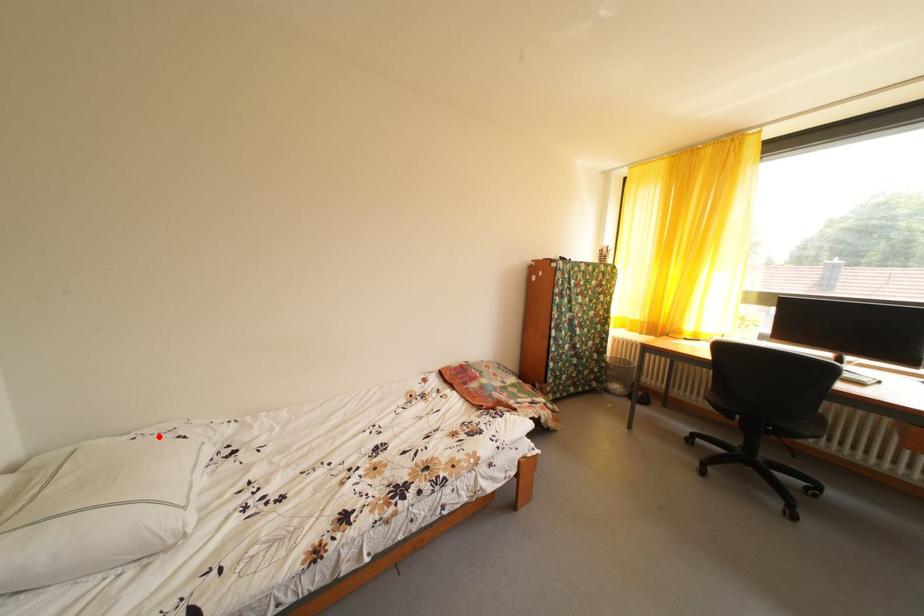
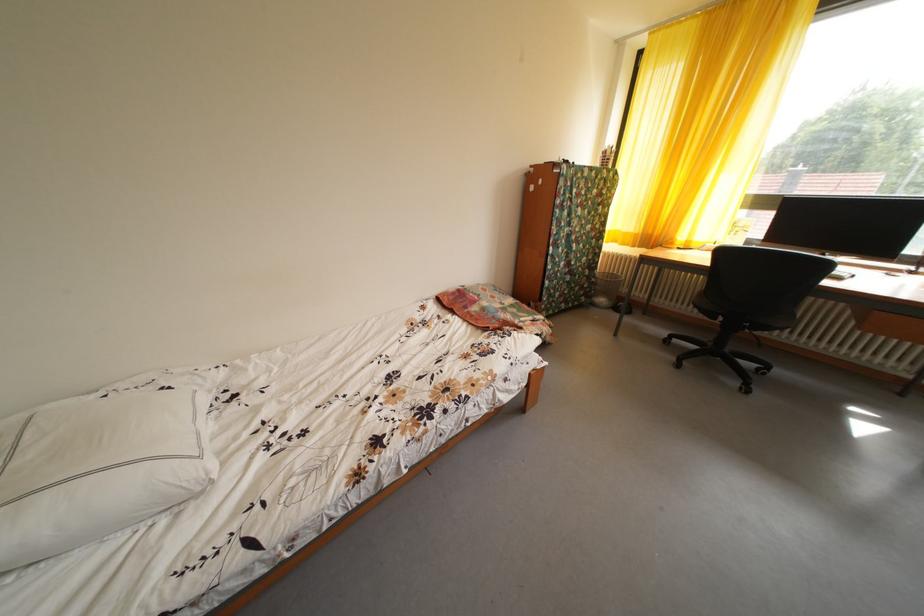
In the second image, find the point that corresponds to the highlighted location in the first image.

(131, 391)